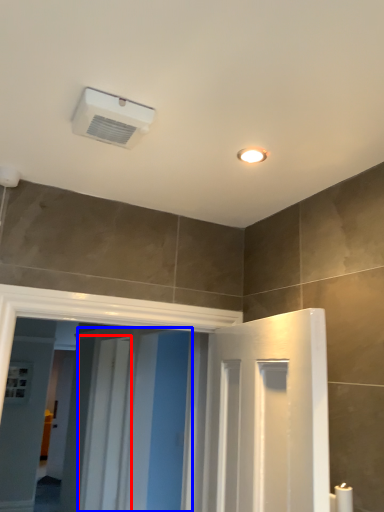
Question: Which point is closer to the camera, screen door (highlighted by a red box) or screen door (highlighted by a blue box)?

Choices:
 (A) screen door
 (B) screen door

Answer: (B)